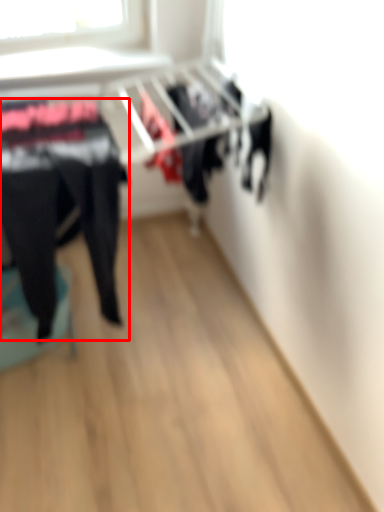
Question: Where is clothing (annotated by the red box) located in relation to furniture in the image?

Choices:
 (A) right
 (B) left

Answer: (A)